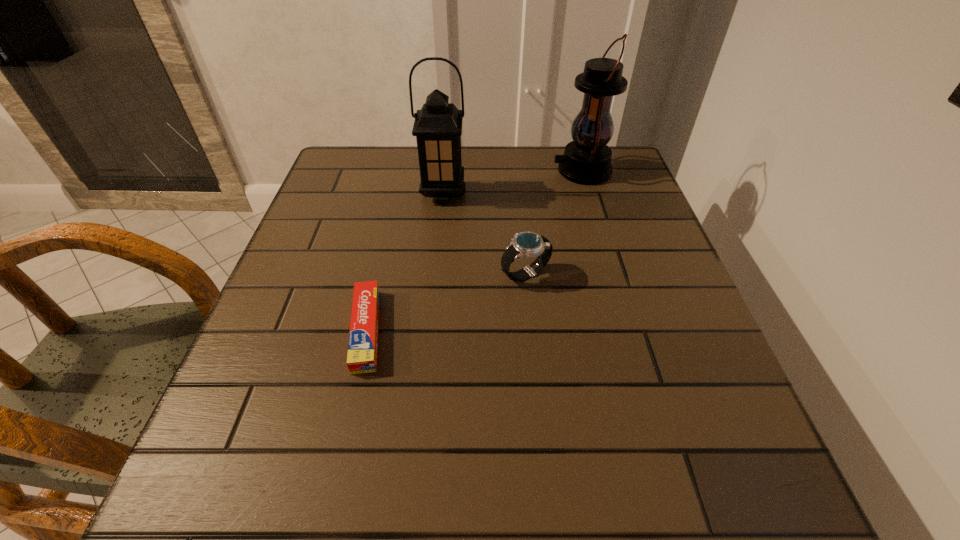
The width and height of the screenshot is (960, 540). I want to click on vacant space positioned 0.260m on the back of the watch, so click(516, 192).

Where is `free region located 0.160m on the left of the toothpaste`? free region located 0.160m on the left of the toothpaste is located at coordinates (261, 330).

I want to click on object at the right edge, so click(x=587, y=159).

Where is `object located in the far right corner section of the desktop`? Image resolution: width=960 pixels, height=540 pixels. object located in the far right corner section of the desktop is located at coordinates (587, 159).

Locate an element on the screen. The width and height of the screenshot is (960, 540). free space at the far edge of the desktop is located at coordinates (528, 186).

Locate an element on the screen. vacant space at the left edge of the desktop is located at coordinates (371, 211).

Image resolution: width=960 pixels, height=540 pixels. In order to click on blank space at the right edge in this screenshot , I will do `click(700, 327)`.

The image size is (960, 540). I want to click on blank space at the near left corner of the desktop, so click(290, 516).

Where is `vacant space at the far right corner of the desktop`? The image size is (960, 540). vacant space at the far right corner of the desktop is located at coordinates (620, 168).

Locate an element on the screen. The height and width of the screenshot is (540, 960). free point between the second nearest object and the left lantern is located at coordinates (484, 234).